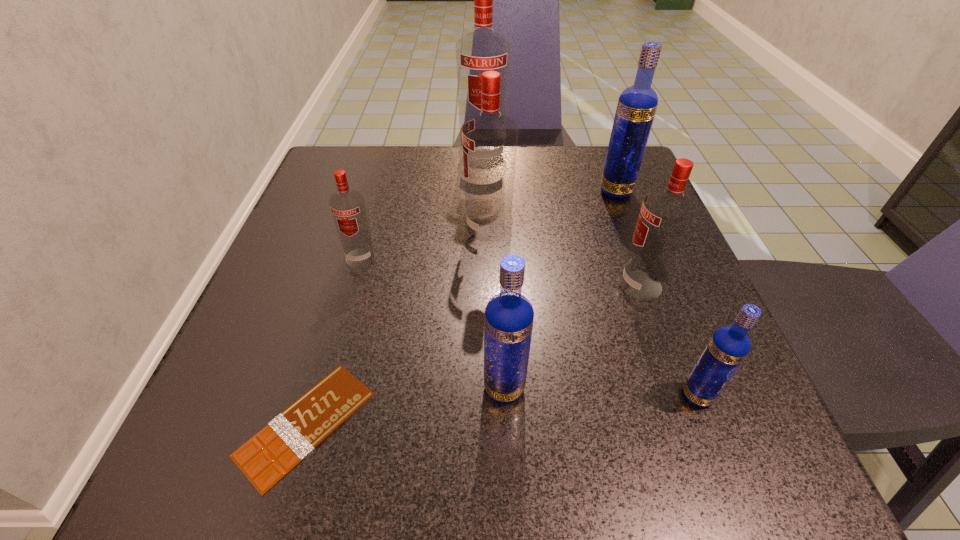
The width and height of the screenshot is (960, 540). What are the coordinates of `vacant region between the leftmost blue vodka and the leftmost red vodka` in the screenshot? It's located at tap(432, 322).

You are a GUI agent. You are given a task and a screenshot of the screen. Output one action in this format:
    pyautogui.click(x=<x>, y=<y>)
    Task: Click on the vacant space in between the farthest object and the smallest red vodka
    This screenshot has width=960, height=540.
    Given the screenshot: What is the action you would take?
    pyautogui.click(x=421, y=208)

The image size is (960, 540). In order to click on vacant space that is in between the sixth nearest vodka and the second smallest blue vodka in this screenshot , I will do `click(560, 289)`.

Identify which object is located as the sixth nearest to the farthest red vodka. Please provide its 2D coordinates. Your answer should be formatted as a tuple, i.e. [(x, y)], where the tuple contains the x and y coordinates of a point satisfying the conditions above.

[(267, 457)]

Where is `the sixth closest object to the tallest object`? This screenshot has height=540, width=960. the sixth closest object to the tallest object is located at coordinates (267, 457).

Identify which vodka is the fourth nearest to the second smallest blue vodka. Please provide its 2D coordinates. Your answer should be formatted as a tuple, i.e. [(x, y)], where the tuple contains the x and y coordinates of a point satisfying the conditions above.

[(348, 209)]

Identify which vodka is located as the sixth nearest to the smallest red vodka. Please provide its 2D coordinates. Your answer should be formatted as a tuple, i.e. [(x, y)], where the tuple contains the x and y coordinates of a point satisfying the conditions above.

[(728, 347)]

Choose which red vodka is the second nearest neighbor to the smallest blue vodka. Please provide its 2D coordinates. Your answer should be formatted as a tuple, i.e. [(x, y)], where the tuple contains the x and y coordinates of a point satisfying the conditions above.

[(490, 138)]

You are a GUI agent. You are given a task and a screenshot of the screen. Output one action in this format:
    pyautogui.click(x=<x>, y=<y>)
    Task: Click on the closest red vodka to the smallest blue vodka
    The width and height of the screenshot is (960, 540).
    Given the screenshot: What is the action you would take?
    pyautogui.click(x=665, y=217)

Identify which blue vodka is the second closest to the second smallest red vodka. Please provide its 2D coordinates. Your answer should be formatted as a tuple, i.e. [(x, y)], where the tuple contains the x and y coordinates of a point satisfying the conditions above.

[(637, 104)]